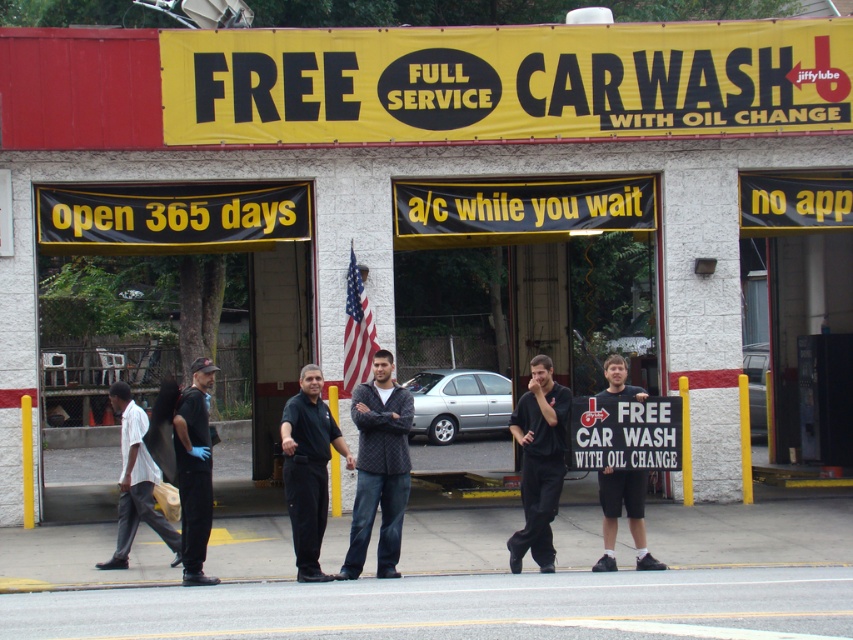
Is white plastic sign at center thinner than black cotton t-shirt at center?

In fact, white plastic sign at center might be wider than black cotton t-shirt at center.

Measure the distance between white plastic sign at center and black cotton t-shirt at center.

white plastic sign at center and black cotton t-shirt at center are 22.46 inches apart.

Does point (589, 413) come closer to viewer compared to point (648, 563)?

No, it is behind (648, 563).

Identify the location of white plastic sign at center. (625, 433).

Measure the distance between quilted sweater at center and camera.

10.44 meters

Who is higher up, quilted sweater at center or black cotton t-shirt at center?

Positioned higher is black cotton t-shirt at center.

Which is in front, point (361, 468) or point (604, 552)?

Point (361, 468)

I want to click on quilted sweater at center, so click(x=379, y=467).

Does dark blue uniform at center appear under black cotton t-shirt at center?

Yes, dark blue uniform at center is below black cotton t-shirt at center.

Is dark blue uniform at center wider than black cotton t-shirt at center?

Correct, the width of dark blue uniform at center exceeds that of black cotton t-shirt at center.

Identify the location of dark blue uniform at center. (194, 470).

Image resolution: width=853 pixels, height=640 pixels. In order to click on dark blue uniform at center in this screenshot , I will do [194, 470].